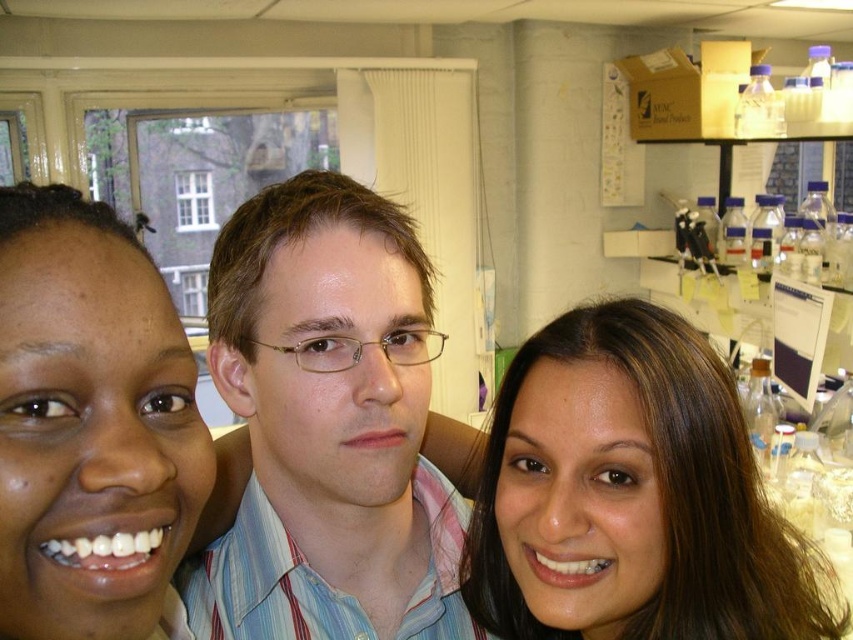
Based on the photo, who is more forward, (350, 248) or (640, 420)?

Point (640, 420)

Is point (360, 449) more distant than point (694, 467)?

Yes, it is behind point (694, 467).

Is point (234, 362) positioned after point (514, 512)?

Yes.

Find the location of a particular element. This screenshot has width=853, height=640. light blue striped shirt at center is located at coordinates (329, 424).

Describe the element at coordinates (329, 424) in the screenshot. The width and height of the screenshot is (853, 640). I see `light blue striped shirt at center` at that location.

Is point (426, 336) positioned before point (35, 636)?

No, it is not.

Who is more distant from viewer, (409,323) or (42,564)?

Positioned behind is point (409,323).

I want to click on light blue striped shirt at center, so click(x=329, y=424).

Does brown hair at upper right come in front of smooth skin face at left?

No, it is behind smooth skin face at left.

Which is below, brown hair at upper right or smooth skin face at left?

Positioned lower is brown hair at upper right.

The height and width of the screenshot is (640, 853). In order to click on brown hair at upper right in this screenshot , I will do `click(631, 496)`.